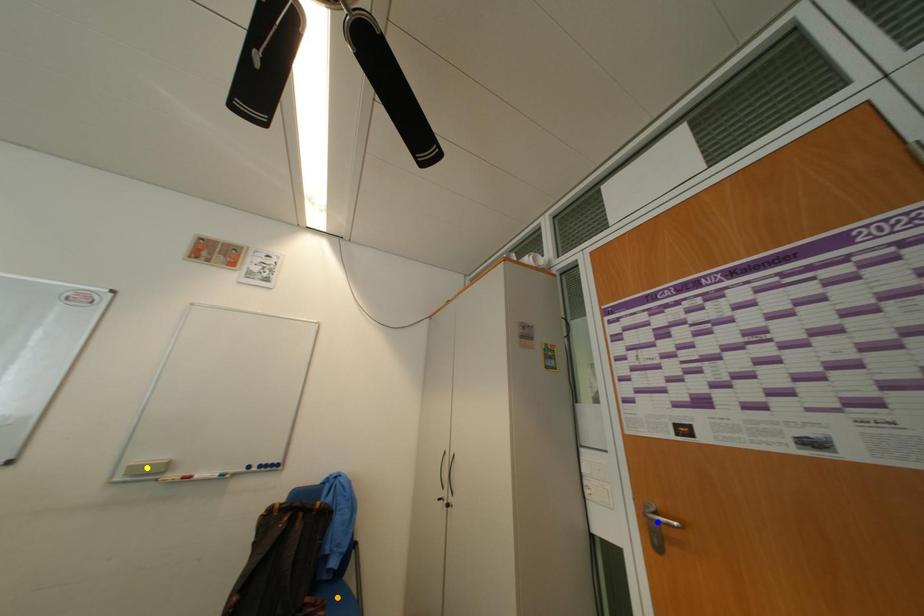
Order these from farthest to nearest:
A) orange point
B) yellow point
C) blue point

orange point
yellow point
blue point